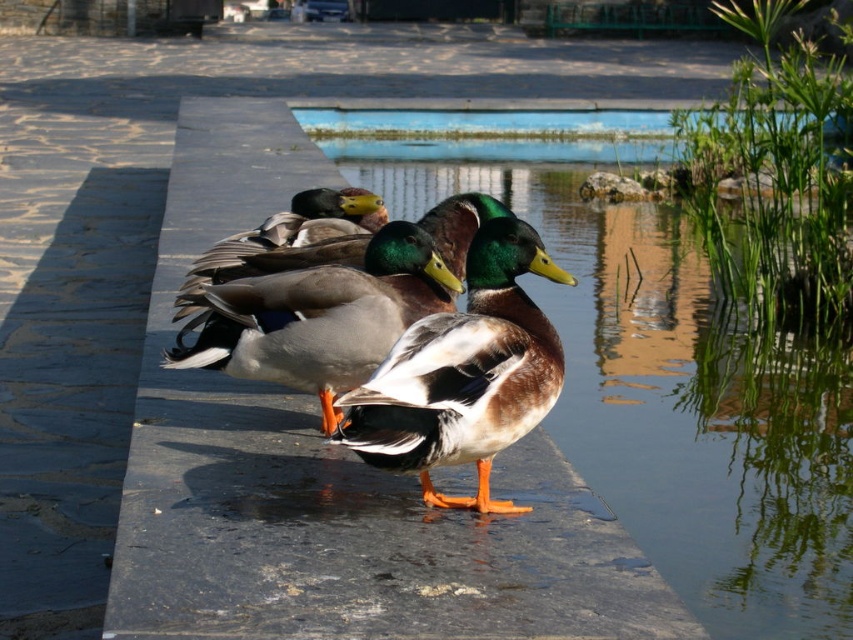
You are standing in the scene and want to feed the brown glossy duck at center. If your maximum reaching distance is 3 meters, can you reach the duck without moving closer?

The brown glossy duck at center is 3.69 meters away from the viewer. Since your maximum reaching distance is 3 meters, you cannot reach the duck without moving closer.

You are planning to place a small decorative statue that requires a base of at least 1 meter in diameter. Based on the scene, which object between the smooth stone ledge at center and the blue concrete pool at center would be more suitable for placing the statue?

The smooth stone ledge at center has a larger size compared to the blue concrete pool at center, so it would be more suitable for placing the statue requiring a base of at least 1 meter in diameter.

You are a duck trying to reach the water. You see the smooth stone ledge at center and the blue concrete pool at center. Which one is closer to the ground?

The smooth stone ledge at center is below the blue concrete pool at center, so the smooth stone ledge at center is closer to the ground.